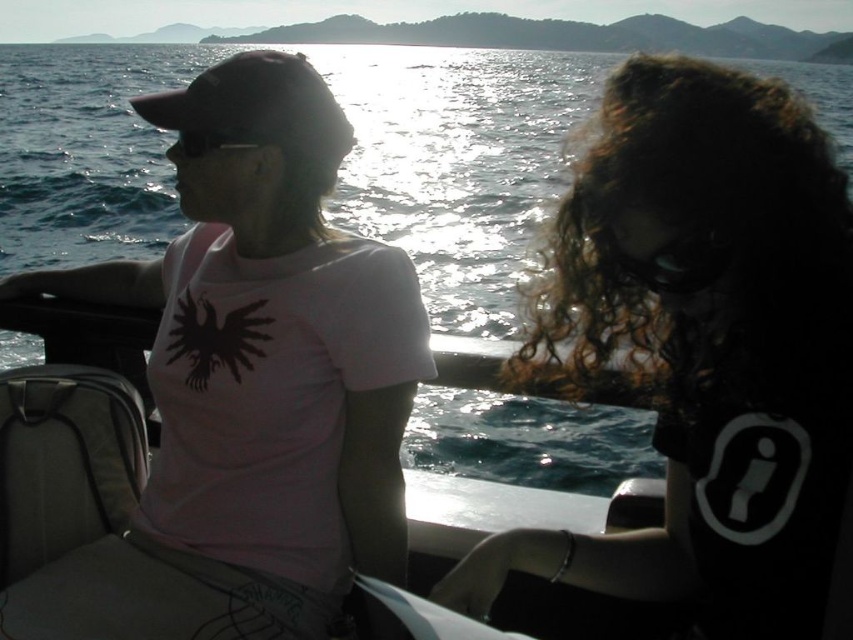
Is pink matte t-shirt at left closer to the viewer compared to black matte shirt at upper right?

No, it is behind black matte shirt at upper right.

Who is more forward, (393, 406) or (621, 269)?

Point (621, 269) is more forward.

Is point (302, 483) positioned in front of point (824, 339)?

No, (302, 483) is further to viewer.

Where is `pink matte t-shirt at left`? The image size is (853, 640). pink matte t-shirt at left is located at coordinates (248, 384).

Can you confirm if black matte shirt at upper right is thinner than glistening water at center?

Indeed, black matte shirt at upper right has a lesser width compared to glistening water at center.

Locate an element on the screen. black matte shirt at upper right is located at coordinates (701, 346).

Who is positioned more to the right, pink matte t-shirt at left or glistening water at center?

From the viewer's perspective, pink matte t-shirt at left appears more on the right side.

Who is positioned more to the left, pink matte t-shirt at left or glistening water at center?

From the viewer's perspective, glistening water at center appears more on the left side.

Between point (318, 180) and point (15, 269), which one is positioned in front?

Point (318, 180) is in front.

The height and width of the screenshot is (640, 853). I want to click on pink matte t-shirt at left, so pyautogui.click(x=248, y=384).